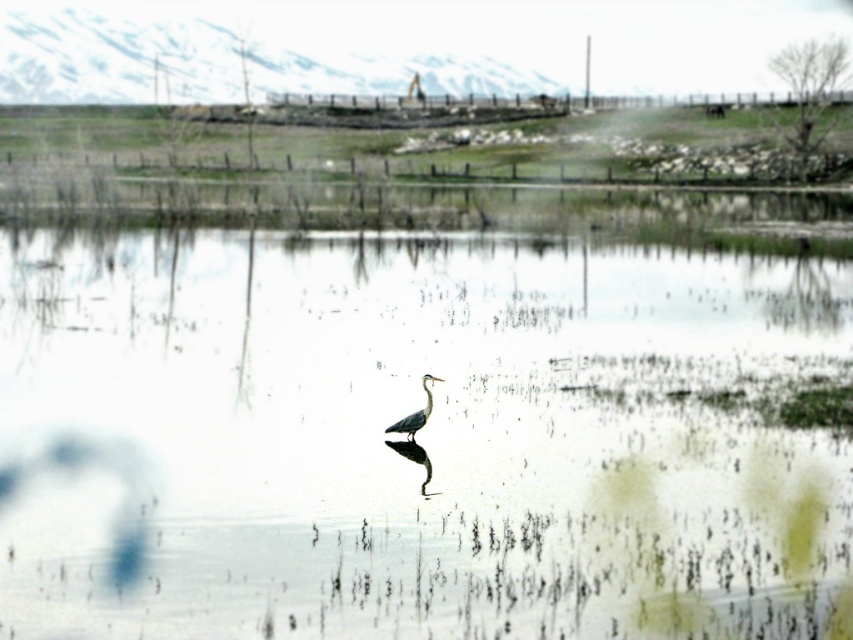
Between clear water at center and gray matte bird at center, which one is positioned lower?

Positioned lower is gray matte bird at center.

Does point (419, 298) come closer to viewer compared to point (426, 385)?

That is False.

Is point (763, 260) less distant than point (433, 376)?

No, it is behind (433, 376).

Identify the location of clear water at center. This screenshot has width=853, height=640. (422, 429).